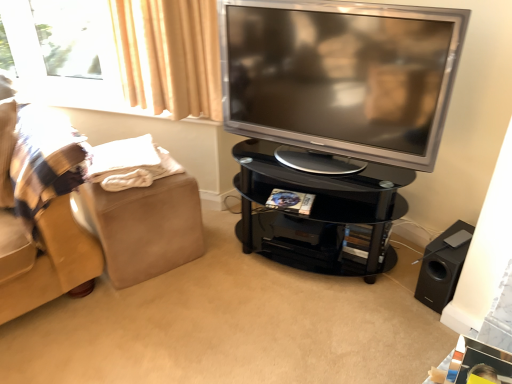
Question: Is black glossy tv stand at center not close to black matte speaker at lower right?

Choices:
 (A) no
 (B) yes

Answer: (A)

Question: Is black glossy tv stand at center in contact with black matte speaker at lower right?

Choices:
 (A) no
 (B) yes

Answer: (A)

Question: Considering the relative sizes of black glossy tv stand at center and black matte speaker at lower right in the image provided, is black glossy tv stand at center thinner than black matte speaker at lower right?

Choices:
 (A) no
 (B) yes

Answer: (A)

Question: From a real-world perspective, is black glossy tv stand at center beneath black matte speaker at lower right?

Choices:
 (A) no
 (B) yes

Answer: (B)

Question: Is black glossy tv stand at center completely or partially outside of black matte speaker at lower right?

Choices:
 (A) no
 (B) yes

Answer: (B)

Question: Does point (448, 248) appear closer or farther from the camera than point (167, 284)?

Choices:
 (A) closer
 (B) farther

Answer: (A)

Question: Looking at the image, does black matte speaker at lower right seem bigger or smaller compared to black glossy tv stand at center?

Choices:
 (A) big
 (B) small

Answer: (B)

Question: Visually, is black matte speaker at lower right positioned to the left or to the right of black glossy tv stand at center?

Choices:
 (A) right
 (B) left

Answer: (A)

Question: From the image's perspective, is black matte speaker at lower right positioned above or below black glossy tv stand at center?

Choices:
 (A) above
 (B) below

Answer: (A)

Question: Based on their positions, is beige fabric footrest at left located to the left or right of black glossy tv stand at center?

Choices:
 (A) right
 (B) left

Answer: (B)

Question: Is beige fabric footrest at left wider or thinner than black glossy tv stand at center?

Choices:
 (A) thin
 (B) wide

Answer: (A)

Question: Is beige fabric footrest at left spatially inside black glossy tv stand at center, or outside of it?

Choices:
 (A) inside
 (B) outside

Answer: (B)

Question: Is beige fabric footrest at left in front of or behind black glossy tv stand at center in the image?

Choices:
 (A) behind
 (B) front

Answer: (A)

Question: Is point (445, 231) positioned closer to the camera than point (301, 81)?

Choices:
 (A) closer
 (B) farther

Answer: (B)

Question: From a real-world perspective, is black matte speaker at lower right physically located above or below silver metallic television at upper right?

Choices:
 (A) below
 (B) above

Answer: (A)